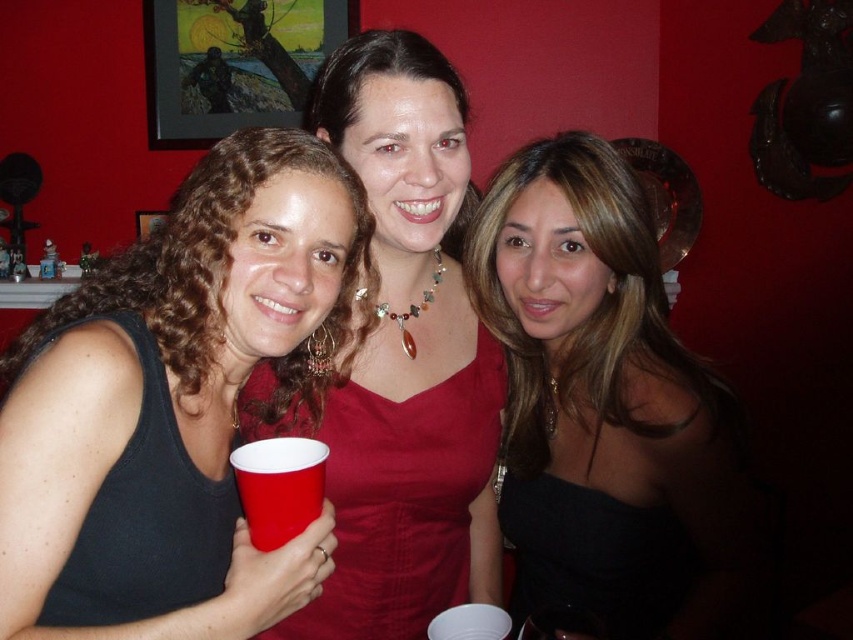
The height and width of the screenshot is (640, 853). Describe the element at coordinates (144, 516) in the screenshot. I see `black matte tank top at left` at that location.

Between black matte tank top at left and red plastic cup at left, which one has less height?

red plastic cup at left

Is point (225, 524) positioned behind point (276, 509)?

Yes, point (225, 524) is behind point (276, 509).

At what (x,y) coordinates should I click in order to perform the action: click on black matte tank top at left. Please return your answer as a coordinate pair (x, y). Looking at the image, I should click on (144, 516).

Is matte black tank top at left thinner than black satin dress at center?

Incorrect, matte black tank top at left's width is not less than black satin dress at center's.

Is matte black tank top at left smaller than black satin dress at center?

Correct, matte black tank top at left occupies less space than black satin dress at center.

Who is more distant from viewer, (238, 385) or (561, 147)?

The point (561, 147) is behind.

Locate an element on the screen. The width and height of the screenshot is (853, 640). matte black tank top at left is located at coordinates (181, 380).

Which is in front, point (648, 291) or point (143, 481)?

Point (143, 481) is more forward.

Does black satin dress at center have a smaller size compared to black matte tank top at left?

Actually, black satin dress at center might be larger than black matte tank top at left.

This screenshot has width=853, height=640. I want to click on black satin dress at center, so click(x=604, y=404).

Where is `black satin dress at center`? The width and height of the screenshot is (853, 640). black satin dress at center is located at coordinates (604, 404).